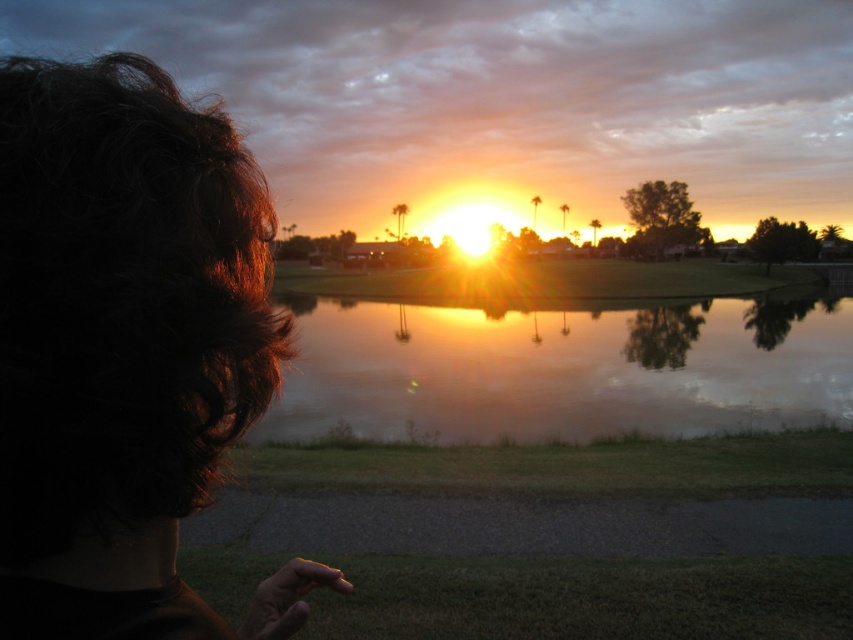
Question: Is dark brown hair at left closer to the viewer compared to glistening reflective water at center?

Choices:
 (A) yes
 (B) no

Answer: (A)

Question: Which point is farther from the camera taking this photo?

Choices:
 (A) (61, 250)
 (B) (602, 406)
 (C) (444, 296)

Answer: (C)

Question: Which object is closer to the camera taking this photo?

Choices:
 (A) green grassy golf course at center
 (B) dark brown hair at left
 (C) glistening reflective water at center

Answer: (B)

Question: Which point is closer to the camera?

Choices:
 (A) glistening reflective water at center
 (B) green grassy golf course at center

Answer: (A)

Question: Does dark brown hair at left appear under glistening reflective water at center?

Choices:
 (A) yes
 (B) no

Answer: (B)

Question: Does dark brown hair at left come behind green grassy golf course at center?

Choices:
 (A) no
 (B) yes

Answer: (A)